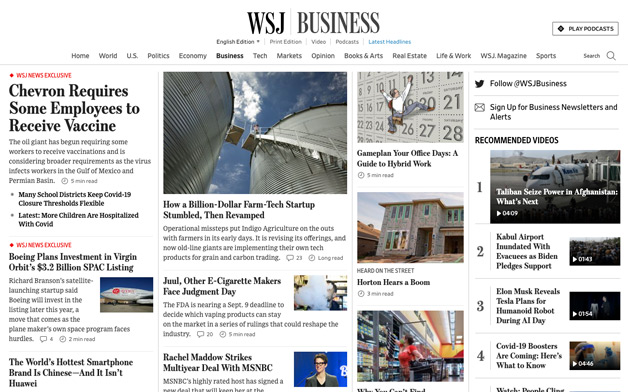
I want to click on calendar, so click(439, 102).